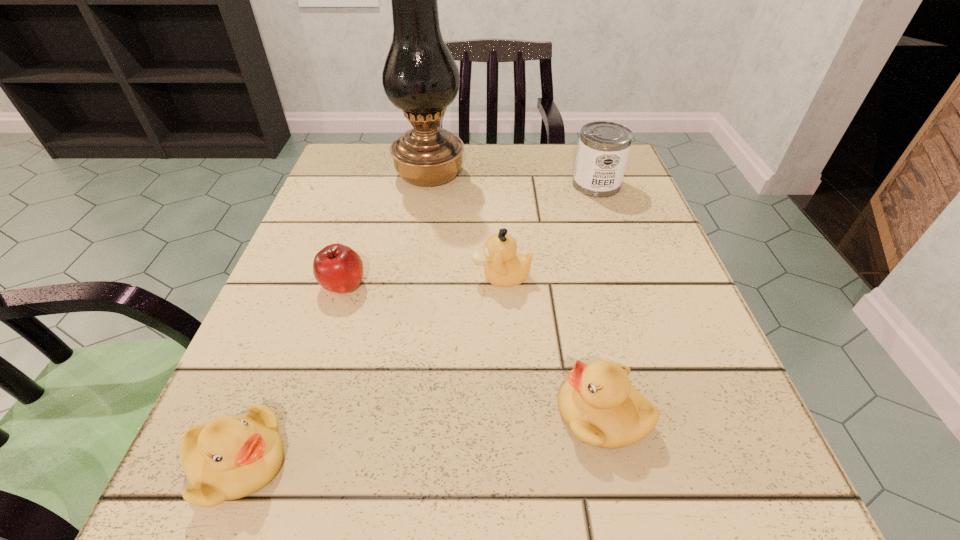
Find the location of a particular element. This screenshot has height=540, width=960. the tallest object is located at coordinates (420, 77).

Identify the location of can. This screenshot has height=540, width=960. (603, 149).

Find the location of a particular element. This screenshot has width=960, height=540. the farthest duckling is located at coordinates (504, 267).

Where is `the second duckling from right to left`? The width and height of the screenshot is (960, 540). the second duckling from right to left is located at coordinates (504, 267).

At what (x,y) coordinates should I click in order to perform the action: click on the rightmost duckling. Please return your answer as a coordinate pair (x, y). The image size is (960, 540). Looking at the image, I should click on (598, 403).

This screenshot has width=960, height=540. What are the coordinates of `apple` in the screenshot? It's located at (337, 268).

Locate an element on the screen. the leftmost duckling is located at coordinates (231, 457).

Find the location of a particular element. The width and height of the screenshot is (960, 540). free space located 0.050m on the left of the tallest object is located at coordinates (372, 174).

The height and width of the screenshot is (540, 960). Identify the location of vacant space located on the left of the can. (550, 185).

At what (x,y) coordinates should I click in order to perform the action: click on vacant space situated on the face of the second duckling from right to left. Please return your answer as a coordinate pair (x, y). The height and width of the screenshot is (540, 960). Looking at the image, I should click on (420, 277).